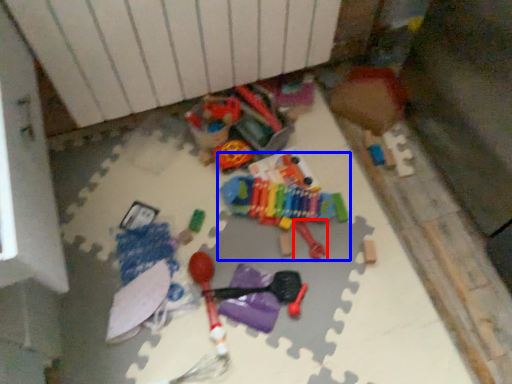
Question: Which point is further to the camera, toy (highlighted by a red box) or toy (highlighted by a blue box)?

Choices:
 (A) toy
 (B) toy

Answer: (B)